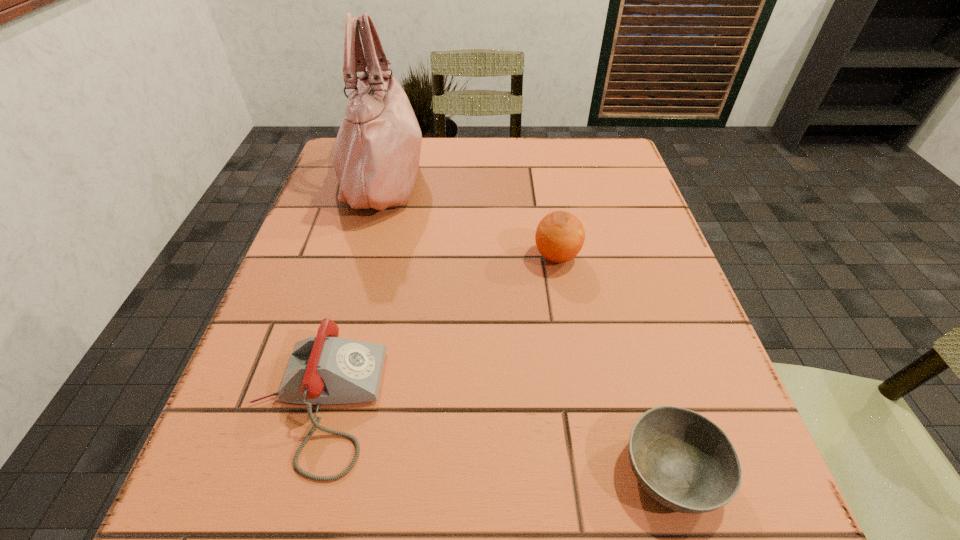
You are a GUI agent. You are given a task and a screenshot of the screen. Output one action in this format:
    pyautogui.click(x=<x>, y=<y>)
    Task: Click on the object that is at the far edge
    The height and width of the screenshot is (540, 960).
    Given the screenshot: What is the action you would take?
    pyautogui.click(x=376, y=158)

The image size is (960, 540). I want to click on telephone that is at the near edge, so click(323, 370).

This screenshot has width=960, height=540. In order to click on bowl located in the near edge section of the desktop in this screenshot , I will do `click(683, 460)`.

You are a GUI agent. You are given a task and a screenshot of the screen. Output one action in this format:
    pyautogui.click(x=<x>, y=<y>)
    Task: Click on the handbag at the left edge
    The height and width of the screenshot is (540, 960).
    Given the screenshot: What is the action you would take?
    pyautogui.click(x=376, y=158)

Where is `telephone that is at the left edge`? The height and width of the screenshot is (540, 960). telephone that is at the left edge is located at coordinates (323, 370).

Find the location of `object that is at the right edge`. object that is at the right edge is located at coordinates (683, 460).

Find the location of a particular element. This screenshot has height=540, width=960. object that is positioned at the far left corner is located at coordinates (376, 158).

At what (x,y) coordinates should I click in order to perform the action: click on object present at the near left corner. Please return your answer as a coordinate pair (x, y). Image resolution: width=960 pixels, height=540 pixels. Looking at the image, I should click on (323, 370).

The image size is (960, 540). What are the coordinates of `object at the near right corner` in the screenshot? It's located at (683, 460).

This screenshot has height=540, width=960. In order to click on vacant region at the far edge of the desktop in this screenshot , I will do pyautogui.click(x=424, y=154).